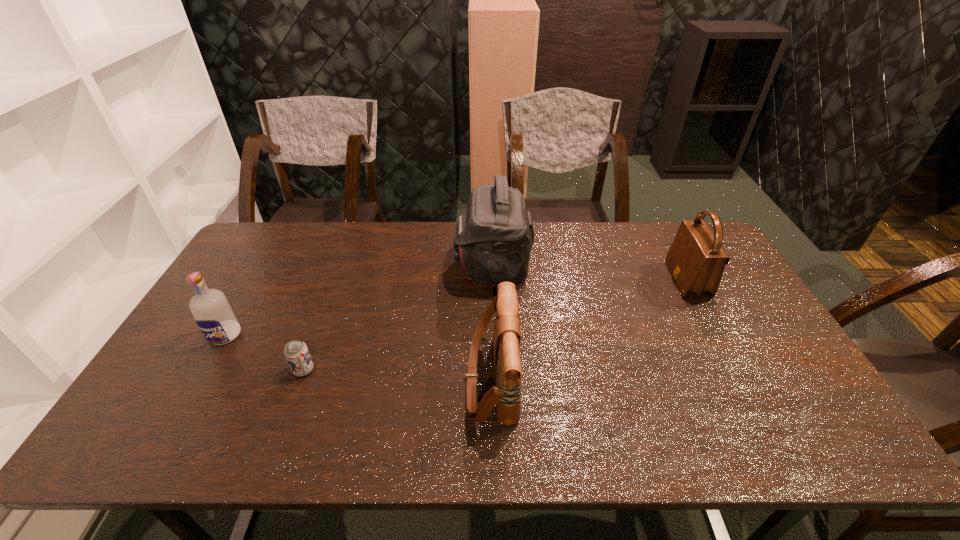
The image size is (960, 540). I want to click on blank space that satisfies the following two spatial constraints: 1. on the label of the vodka; 2. on the left side of the fourth object from right to left, so click(205, 370).

Where is `free space that satisfies the following two spatial constraints: 1. on the open flap of the tallest shoulder bag; 2. on the label of the vodka`? free space that satisfies the following two spatial constraints: 1. on the open flap of the tallest shoulder bag; 2. on the label of the vodka is located at coordinates (494, 335).